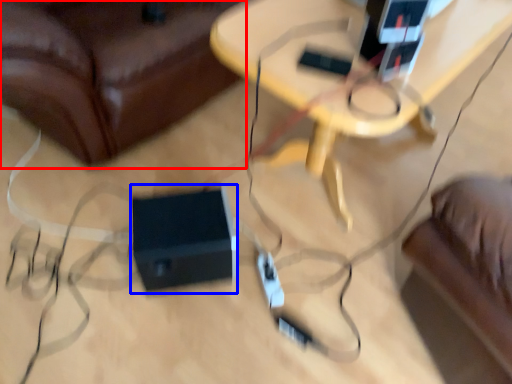
Question: Which point is further to the camera, furniture (highlighted by a red box) or speaker (highlighted by a blue box)?

Choices:
 (A) furniture
 (B) speaker

Answer: (B)